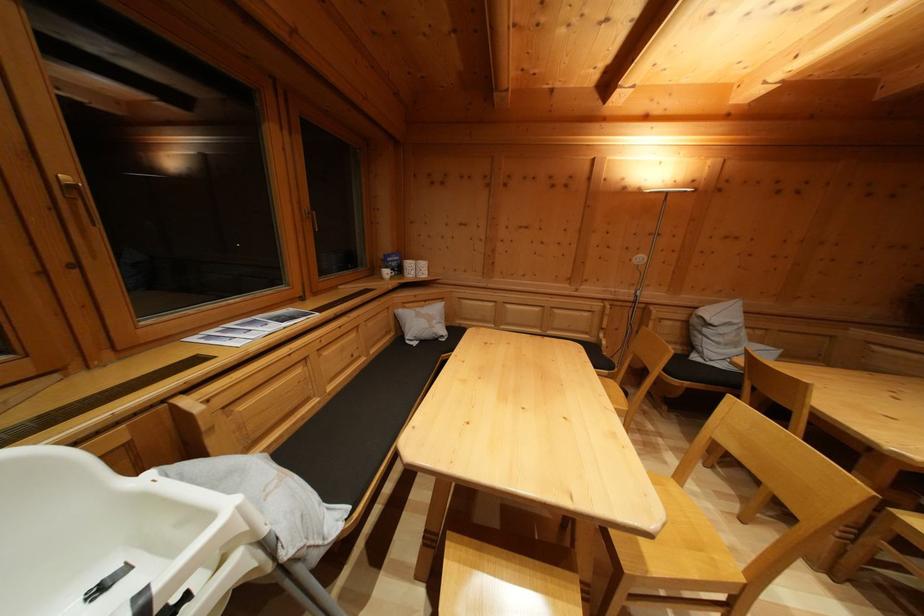
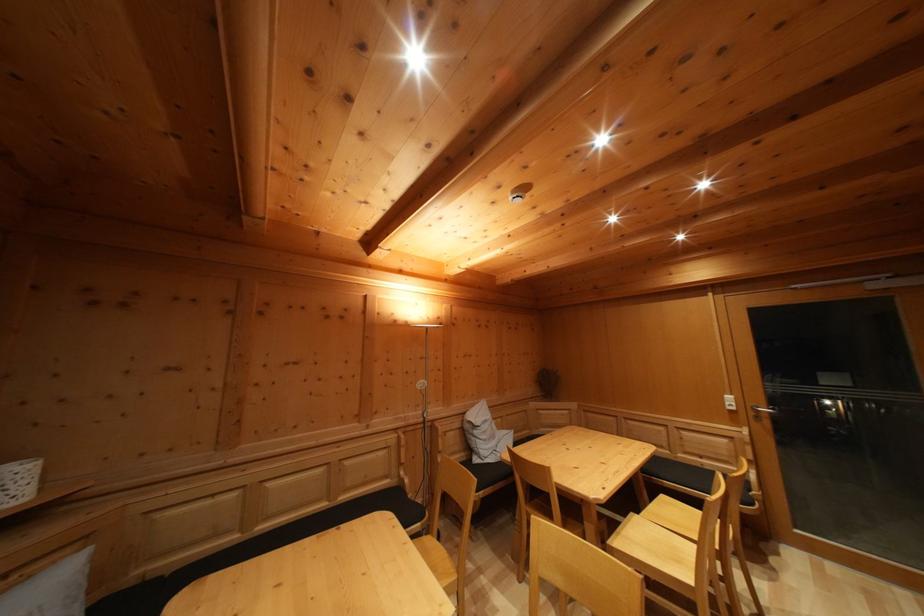
The images are taken continuously from a first-person perspective. In which direction is your viewpoint rotating?

The rotation direction of the camera is right-up.